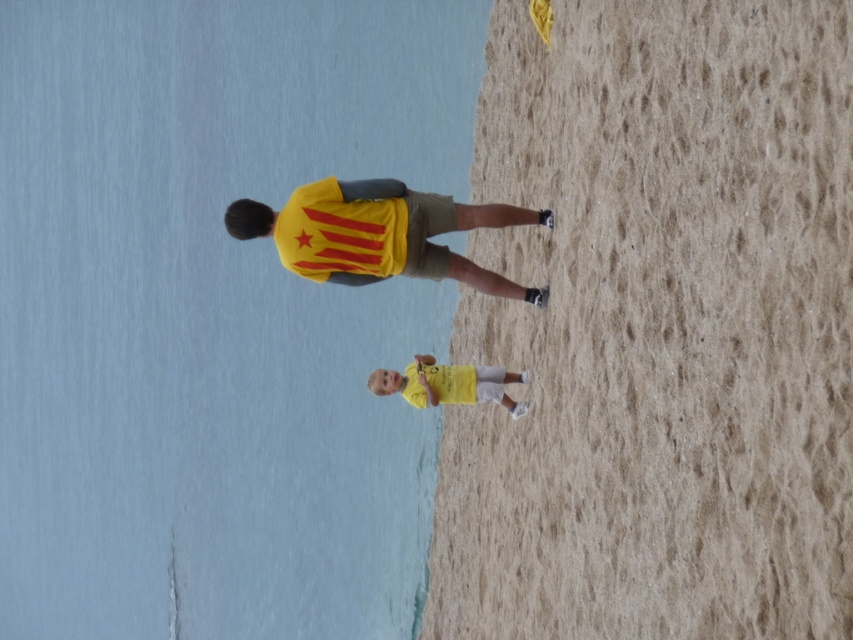
You are standing at the point marked as point (477, 385) and want to walk towards the sea. Is the point marked as point (572, 115) blocking your path?

Point (572, 115) is in front of point (477, 385), so yes, it is blocking your path.